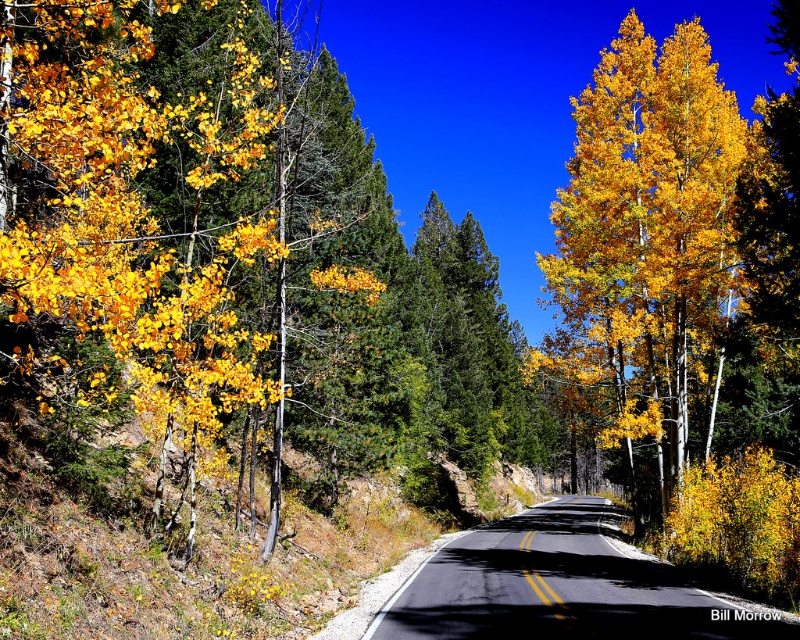
Measure the distance from golden yellow leaves at right to black asphalt road at center.

golden yellow leaves at right and black asphalt road at center are 8.80 meters apart.

Is point (716, 260) positioned before point (478, 605)?

No.

Where is `golden yellow leaves at right`? Image resolution: width=800 pixels, height=640 pixels. golden yellow leaves at right is located at coordinates (644, 252).

Which is below, golden yellow leaves at left or black asphalt road at center?

Positioned lower is black asphalt road at center.

Which of these two, golden yellow leaves at left or black asphalt road at center, stands shorter?

black asphalt road at center is shorter.

Image resolution: width=800 pixels, height=640 pixels. I want to click on golden yellow leaves at left, so click(141, 211).

The height and width of the screenshot is (640, 800). What are the coordinates of `golden yellow leaves at left` in the screenshot? It's located at (141, 211).

Between golden yellow leaves at left and golden yellow leaves at right, which one is positioned lower?

Positioned lower is golden yellow leaves at right.

Between point (16, 54) and point (700, 432), which one is positioned in front?

Positioned in front is point (16, 54).

Who is more forward, [97,396] or [562,312]?

Point [97,396] is in front.

Find the location of `golden yellow leaves at left`. golden yellow leaves at left is located at coordinates (141, 211).